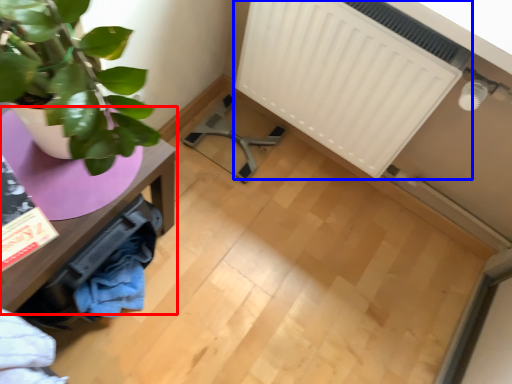
Question: Which point is further to the camera, table (highlighted by a red box) or radiator (highlighted by a blue box)?

Choices:
 (A) table
 (B) radiator

Answer: (B)